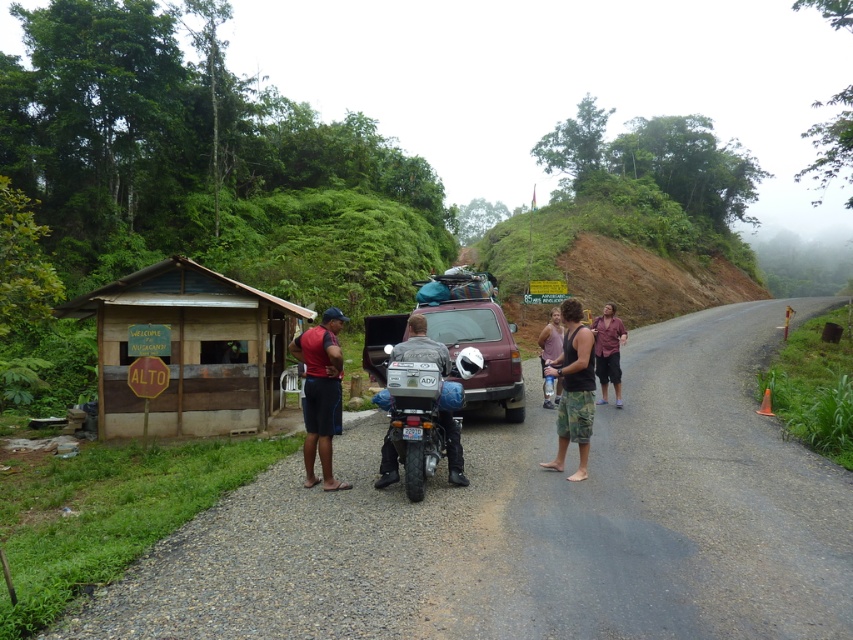
You are a photographer standing at the camera position. You want to take a photo that includes both the point at coordinates point [670,284] and point [395,412]. Which point will appear closer to the bottom edge of the photo?

Point [395,412] will appear closer to the bottom edge of the photo because it is closer to the camera than point [670,284].